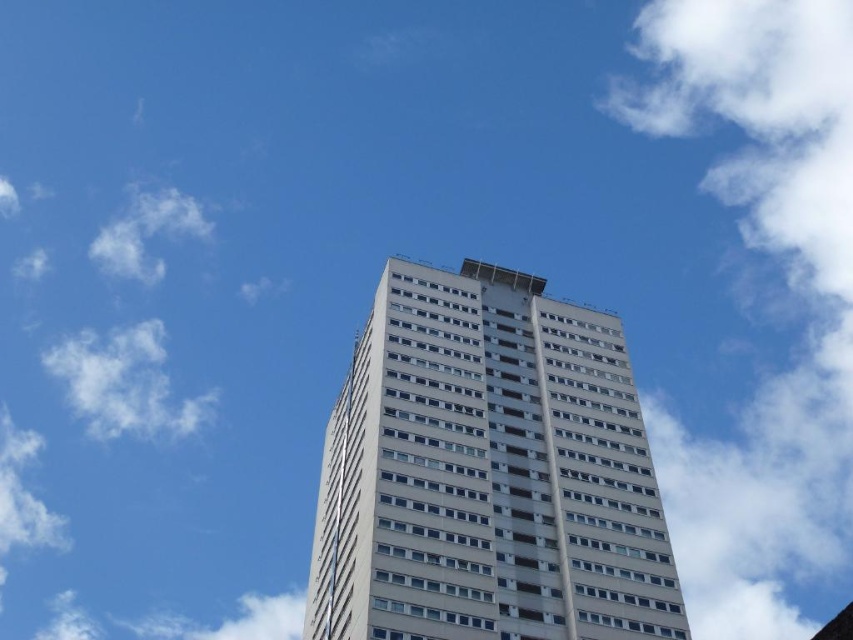
Question: Which point appears closest to the camera in this image?

Choices:
 (A) (86, 332)
 (B) (492, 396)

Answer: (B)

Question: In this image, where is white smooth building at center located relative to white fluffy cloud at upper left?

Choices:
 (A) left
 (B) right

Answer: (B)

Question: Is white smooth building at center below white fluffy cloud at upper left?

Choices:
 (A) yes
 (B) no

Answer: (B)

Question: Can you confirm if white smooth building at center is smaller than white fluffy cloud at upper left?

Choices:
 (A) no
 (B) yes

Answer: (B)